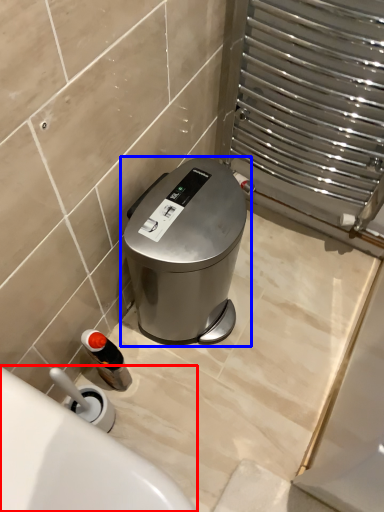
Question: Which of the following is the closest to the observer, bath (highlighted by a red box) or waste container (highlighted by a blue box)?

Choices:
 (A) bath
 (B) waste container

Answer: (A)